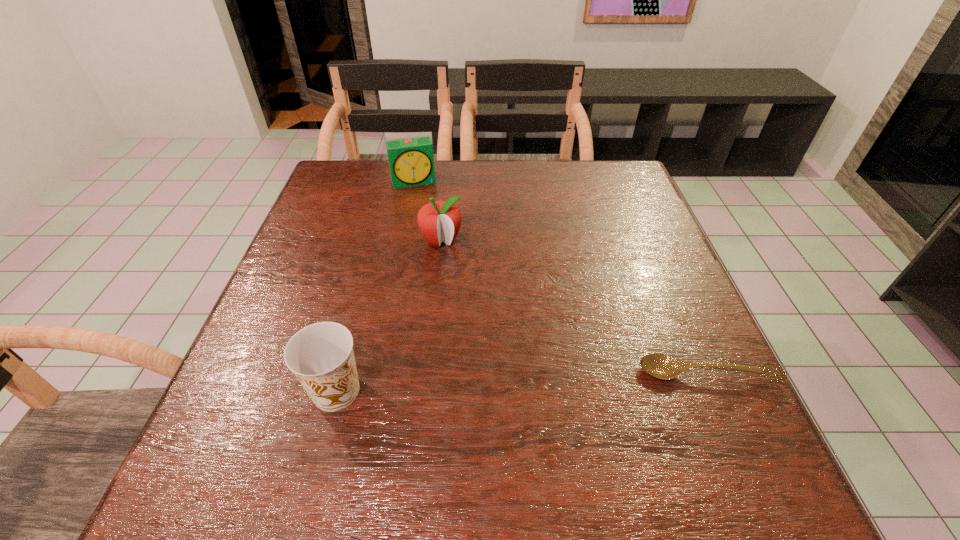
Locate an element on the screen. Image resolution: width=960 pixels, height=540 pixels. vacant space in between the shortest object and the alarm clock is located at coordinates (561, 278).

You are a GUI agent. You are given a task and a screenshot of the screen. Output one action in this format:
    pyautogui.click(x=<x>, y=<y>)
    Task: Click on the vacant region between the shortest object and the alarm clock
    
    Given the screenshot: What is the action you would take?
    pyautogui.click(x=561, y=278)

Find the location of a particular element. This screenshot has width=960, height=540. free space between the farthest object and the shortest object is located at coordinates (561, 278).

What are the coordinates of `free space between the farthest object and the ladle` in the screenshot? It's located at (561, 278).

This screenshot has height=540, width=960. I want to click on unoccupied area between the third nearest object and the shortest object, so click(574, 307).

Select which object is the closest to the ladle. Please provide its 2D coordinates. Your answer should be formatted as a tuple, i.e. [(x, y)], where the tuple contains the x and y coordinates of a point satisfying the conditions above.

[(438, 221)]

Locate an element on the screen. object identified as the third closest to the farthest object is located at coordinates (662, 366).

Identify the location of free point that satisfies the following two spatial constraints: 1. on the back side of the Dixie cup; 2. on the right side of the second farthest object. This screenshot has width=960, height=540. (376, 241).

This screenshot has width=960, height=540. What are the coordinates of `free point that satisfies the following two spatial constraints: 1. on the back side of the Dixie cup; 2. on the right side of the second farthest object` in the screenshot? It's located at (376, 241).